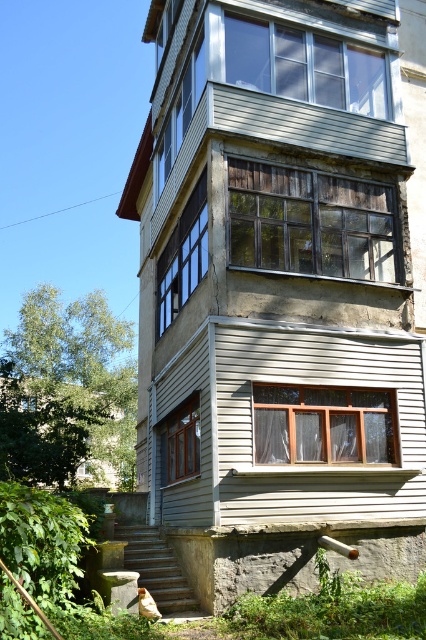
You are standing in front of the residential building and want to take a photo. You notice two points on the building marked as point 1 at coordinates [365,275] and point 2 at coordinates [198,237]. Which point is closer to your camera?

Point 1 at coordinates [365,275] is closer to the camera than point 2 at coordinates [198,237].

You are an architect inspecting the building. You notice two wooden structures at the center of the building. One is labeled as the wooden window at center and the other as the wooden frame at center. Which of these two is smaller in size?

The wooden window at center is smaller in size compared to the wooden frame at center.